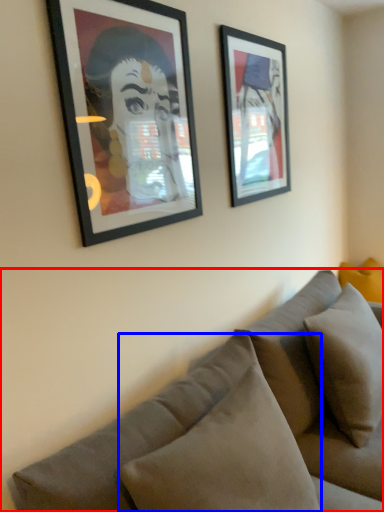
Question: Which point is closer to the camera, studio couch (highlighted by a red box) or pillow (highlighted by a blue box)?

Choices:
 (A) studio couch
 (B) pillow

Answer: (A)